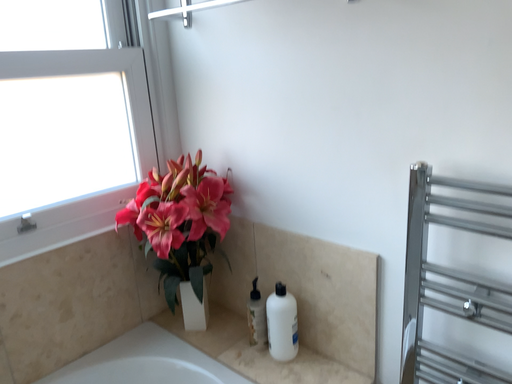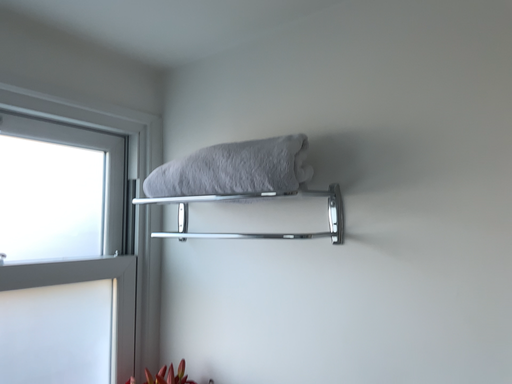
Question: How did the camera likely rotate when shooting the video?

Choices:
 (A) rotated right
 (B) rotated left

Answer: (A)